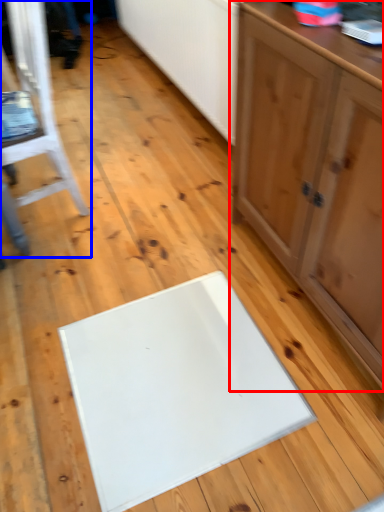
Question: Which object is further to the camera taking this photo, cabinetry (highlighted by a red box) or furniture (highlighted by a blue box)?

Choices:
 (A) cabinetry
 (B) furniture

Answer: (B)